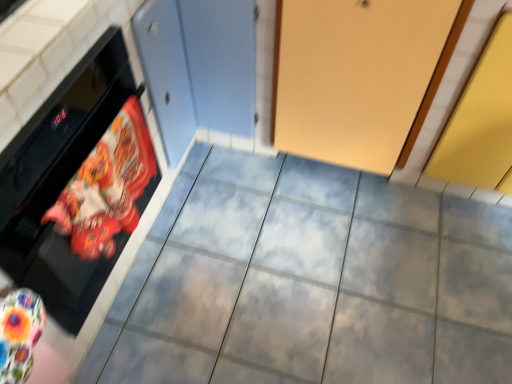
What do you see at coordinates (106, 186) in the screenshot? I see `printed fabric oven mitt at left` at bounding box center [106, 186].

Image resolution: width=512 pixels, height=384 pixels. What are the coordinates of `black glossy oven at left` in the screenshot? It's located at (61, 182).

This screenshot has width=512, height=384. Describe the element at coordinates (310, 281) in the screenshot. I see `matte gray tile at center` at that location.

Where is `printed fabric oven mitt at left`? printed fabric oven mitt at left is located at coordinates (106, 186).

Is matte gray tile at center inside or outside of black glossy oven at left?

matte gray tile at center exists outside the volume of black glossy oven at left.

From the image's perspective, who appears lower, matte gray tile at center or black glossy oven at left?

matte gray tile at center.

Looking at this image, what's the angular difference between matte gray tile at center and black glossy oven at left's facing directions?

matte gray tile at center and black glossy oven at left are facing 89.5 degrees away from each other.

Who is more distant, matte gray tile at center or black glossy oven at left?

matte gray tile at center is behind.

From the image's perspective, is printed fabric oven mitt at left beneath black glossy oven at left?

Yes, from the image's perspective, printed fabric oven mitt at left is beneath black glossy oven at left.

From a real-world perspective, which is physically above, printed fabric oven mitt at left or black glossy oven at left?

printed fabric oven mitt at left.

Looking at the image, does printed fabric oven mitt at left seem bigger or smaller compared to black glossy oven at left?

In the image, printed fabric oven mitt at left appears to be smaller than black glossy oven at left.

Considering the relative sizes of printed fabric oven mitt at left and black glossy oven at left in the image provided, is printed fabric oven mitt at left shorter than black glossy oven at left?

Indeed, printed fabric oven mitt at left has a lesser height compared to black glossy oven at left.

From a real-world perspective, is black glossy oven at left on top of printed fabric oven mitt at left?

Incorrect, from a real-world perspective, black glossy oven at left is lower than printed fabric oven mitt at left.

Which is behind, black glossy oven at left or printed fabric oven mitt at left?

printed fabric oven mitt at left is more distant.

Between black glossy oven at left and printed fabric oven mitt at left, which one has more height?

black glossy oven at left is taller.

Is matte gray tile at center taller than printed fabric oven mitt at left?

Incorrect, the height of matte gray tile at center is not larger of that of printed fabric oven mitt at left.

Considering the positions of point (232, 247) and point (129, 130), is point (232, 247) closer or farther from the camera than point (129, 130)?

Clearly, point (232, 247) is more distant from the camera than point (129, 130).

From the image's perspective, which is above, matte gray tile at center or printed fabric oven mitt at left?

From the image's view, printed fabric oven mitt at left is above.

From the picture: Which is correct: printed fabric oven mitt at left is inside matte gray tile at center, or outside of it?

printed fabric oven mitt at left is not enclosed by matte gray tile at center.

Is printed fabric oven mitt at left placed right next to matte gray tile at center?

They are not placed beside each other.

Who is shorter, printed fabric oven mitt at left or matte gray tile at center?

With less height is matte gray tile at center.

Which object is wider, printed fabric oven mitt at left or matte gray tile at center?

Wider between the two is matte gray tile at center.

Could you tell me if black glossy oven at left is facing matte gray tile at center?

Yes, black glossy oven at left is facing matte gray tile at center.

Find the location of a particular element. This screenshot has width=512, height=384. oven that is on the left side of matte gray tile at center is located at coordinates (61, 182).

What's the angular difference between black glossy oven at left and matte gray tile at center's facing directions?

There is a 89.5-degree angle between the facing directions of black glossy oven at left and matte gray tile at center.

Between black glossy oven at left and matte gray tile at center, which one has smaller size?

matte gray tile at center.

You are a GUI agent. You are given a task and a screenshot of the screen. Output one action in this format:
    pyautogui.click(x=<x>, y=<y>)
    Task: Click on the oven that is above the matte gray tile at center (from the image's perspective)
    The width and height of the screenshot is (512, 384).
    Given the screenshot: What is the action you would take?
    pyautogui.click(x=61, y=182)

In the image, there is a black glossy oven at left. Where is `material below it (from the image's perspective)`? material below it (from the image's perspective) is located at coordinates 106,186.

Based on their spatial positions, is matte gray tile at center or printed fabric oven mitt at left further from black glossy oven at left?

Based on the image, matte gray tile at center appears to be further to black glossy oven at left.

Which object lies nearer to the anchor point matte gray tile at center, black glossy oven at left or printed fabric oven mitt at left?

Based on the image, printed fabric oven mitt at left appears to be nearer to matte gray tile at center.

Which object lies nearer to the anchor point black glossy oven at left, printed fabric oven mitt at left or matte gray tile at center?

printed fabric oven mitt at left.

Looking at this image, looking at the image, which one is located closer to matte gray tile at center, printed fabric oven mitt at left or black glossy oven at left?

Based on the image, printed fabric oven mitt at left appears to be nearer to matte gray tile at center.

Estimate the real-world distances between objects in this image. Which object is further from printed fabric oven mitt at left, black glossy oven at left or matte gray tile at center?

The object further to printed fabric oven mitt at left is matte gray tile at center.

Considering their positions, is matte gray tile at center positioned further to printed fabric oven mitt at left than black glossy oven at left?

matte gray tile at center is further to printed fabric oven mitt at left.

Identify the location of material between black glossy oven at left and matte gray tile at center. The height and width of the screenshot is (384, 512). click(x=106, y=186).